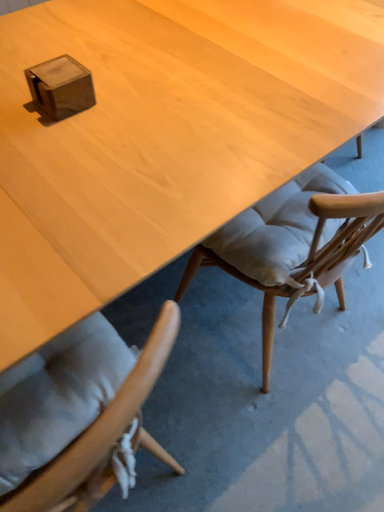
In order to face wooden cube at upper left, should I rotate leftwards or rightwards?

Rotate your view left by about 16.571°.

Describe the element at coordinates (61, 87) in the screenshot. I see `wooden cube at upper left` at that location.

Locate an element on the screen. Image resolution: width=384 pixels, height=512 pixels. wooden cube at upper left is located at coordinates point(61,87).

Locate an element on the screen. This screenshot has height=512, width=384. light wood desk at center is located at coordinates (163, 136).

Image resolution: width=384 pixels, height=512 pixels. What do you see at coordinates (163, 136) in the screenshot?
I see `light wood desk at center` at bounding box center [163, 136].

What is the approximate width of light wood desk at center?

light wood desk at center is 22.92 inches wide.

The height and width of the screenshot is (512, 384). Identify the location of wooden cube at upper left. (61, 87).

Considering the positions of objects light wood desk at center and wooden cube at upper left in the image provided, who is more to the left, light wood desk at center or wooden cube at upper left?

From the viewer's perspective, wooden cube at upper left appears more on the left side.

Considering the positions of objects light wood desk at center and wooden cube at upper left in the image provided, who is behind, light wood desk at center or wooden cube at upper left?

wooden cube at upper left.

Is point (51, 223) closer or farther from the camera than point (43, 106)?

Point (51, 223).

From the image's perspective, between light wood desk at center and wooden cube at upper left, which one is located above?

From the image's view, wooden cube at upper left is above.

From a real-world perspective, is light wood desk at center above or below wooden cube at upper left?

light wood desk at center is situated lower than wooden cube at upper left in the real world.

Considering the relative sizes of light wood desk at center and wooden cube at upper left in the image provided, is light wood desk at center wider than wooden cube at upper left?

Yes.

Considering the sizes of objects light wood desk at center and wooden cube at upper left in the image provided, who is shorter, light wood desk at center or wooden cube at upper left?

wooden cube at upper left is shorter.

In the scene shown: Does light wood desk at center have a larger size compared to wooden cube at upper left?

Yes.

Which is correct: light wood desk at center is inside wooden cube at upper left, or outside of it?

light wood desk at center exists outside the volume of wooden cube at upper left.

Would you say light wood desk at center is a long distance from wooden cube at upper left?

light wood desk at center is near wooden cube at upper left, not far away.

Is light wood desk at center looking in the opposite direction of wooden cube at upper left?

No, light wood desk at center is not facing away from wooden cube at upper left.

What's the angular difference between light wood desk at center and wooden cube at upper left's facing directions?

178 degrees separate the facing orientations of light wood desk at center and wooden cube at upper left.

How much distance is there between light wood desk at center and wooden cube at upper left?

light wood desk at center is 12.05 inches from wooden cube at upper left.

Find the location of `box on the left of light wood desk at center`. box on the left of light wood desk at center is located at coordinates (61, 87).

Is wooden cube at upper left at the right side of light wood desk at center?

No, wooden cube at upper left is not to the right of light wood desk at center.

Between wooden cube at upper left and light wood desk at center, which one is positioned behind?

wooden cube at upper left.

Is point (34, 88) farther from camera compared to point (190, 106)?

That is False.

From the image's perspective, is wooden cube at upper left positioned above or below light wood desk at center?

From the image's perspective, wooden cube at upper left appears above light wood desk at center.

From a real-world perspective, is wooden cube at upper left on top of light wood desk at center?

Yes, from a real-world perspective, wooden cube at upper left is on top of light wood desk at center.

Which object is wider, wooden cube at upper left or light wood desk at center?

light wood desk at center is wider.

Does wooden cube at upper left have a lesser height compared to light wood desk at center?

Correct, wooden cube at upper left is not as tall as light wood desk at center.

Between wooden cube at upper left and light wood desk at center, which one has smaller size?

With smaller size is wooden cube at upper left.

Can light wood desk at center be found inside wooden cube at upper left?

That's incorrect, light wood desk at center is not inside wooden cube at upper left.

Are wooden cube at upper left and light wood desk at center making contact?

No, wooden cube at upper left is not with light wood desk at center.

Is wooden cube at upper left facing away from light wood desk at center?

No.

I want to click on desk below the wooden cube at upper left (from the image's perspective), so click(163, 136).

Identify the location of box behind the light wood desk at center. This screenshot has width=384, height=512. (61, 87).

The width and height of the screenshot is (384, 512). In order to click on box positioned vertically above the light wood desk at center (from a real-world perspective) in this screenshot , I will do `click(61, 87)`.